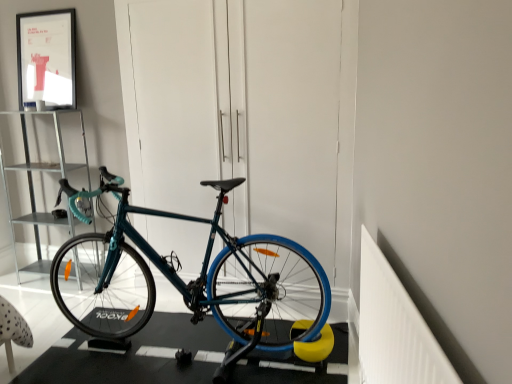
Question: Is matte black picture frame at upper left in front of or behind metallic silver shelf at left in the image?

Choices:
 (A) behind
 (B) front

Answer: (A)

Question: From the image's perspective, is matte black picture frame at upper left positioned above or below metallic silver shelf at left?

Choices:
 (A) below
 (B) above

Answer: (B)

Question: Which object is positioned farthest from the teal matte bicycle at center?

Choices:
 (A) matte black picture frame at upper left
 (B) metallic silver shelf at left

Answer: (A)

Question: Estimate the real-world distances between objects in this image. Which object is farther from the matte black picture frame at upper left?

Choices:
 (A) teal matte bicycle at center
 (B) metallic silver shelf at left

Answer: (A)